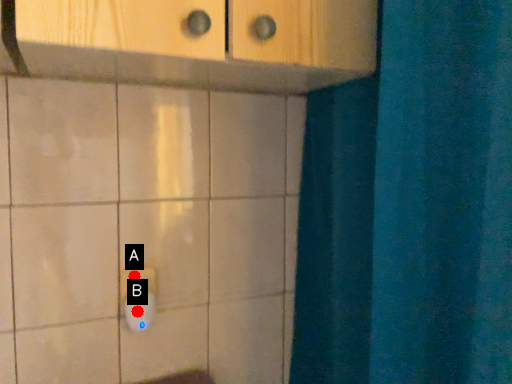
Question: Two points are circled on the image, labeled by A and B beside each circle. Which point appears farthest from the camera in this image?

Choices:
 (A) A is further
 (B) B is further

Answer: (A)